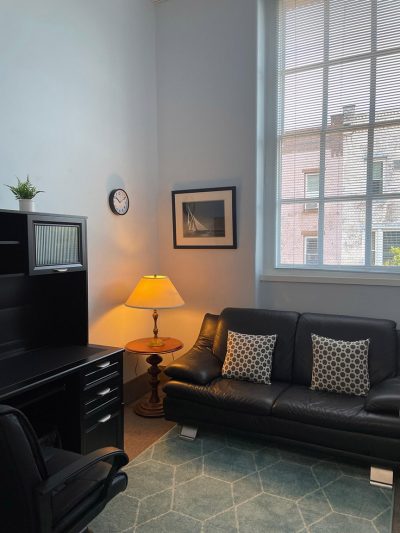
Identify the location of table. This screenshot has width=400, height=533. (146, 349).